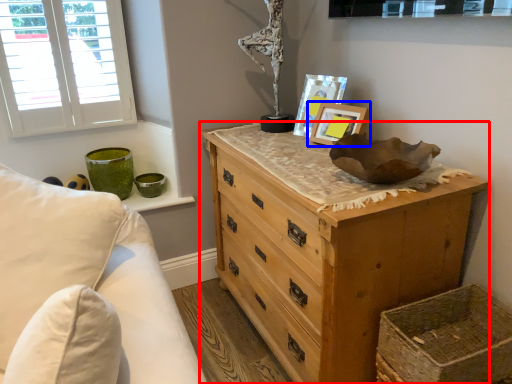
Question: Which object is closer to the camera taking this photo, chest of drawers (highlighted by a red box) or picture frame (highlighted by a blue box)?

Choices:
 (A) chest of drawers
 (B) picture frame

Answer: (A)